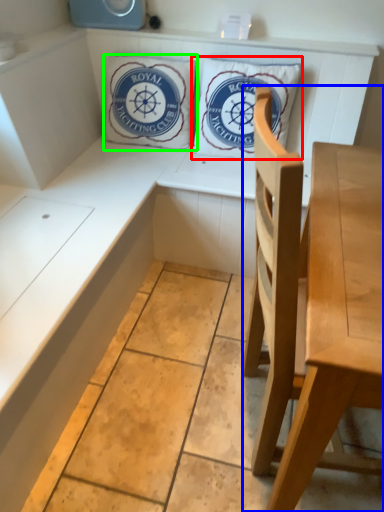
Question: Which object is the closest to the pillow (highlighted by a red box)? Choose among these: chair (highlighted by a blue box) or pillow (highlighted by a green box).

Choices:
 (A) chair
 (B) pillow

Answer: (B)